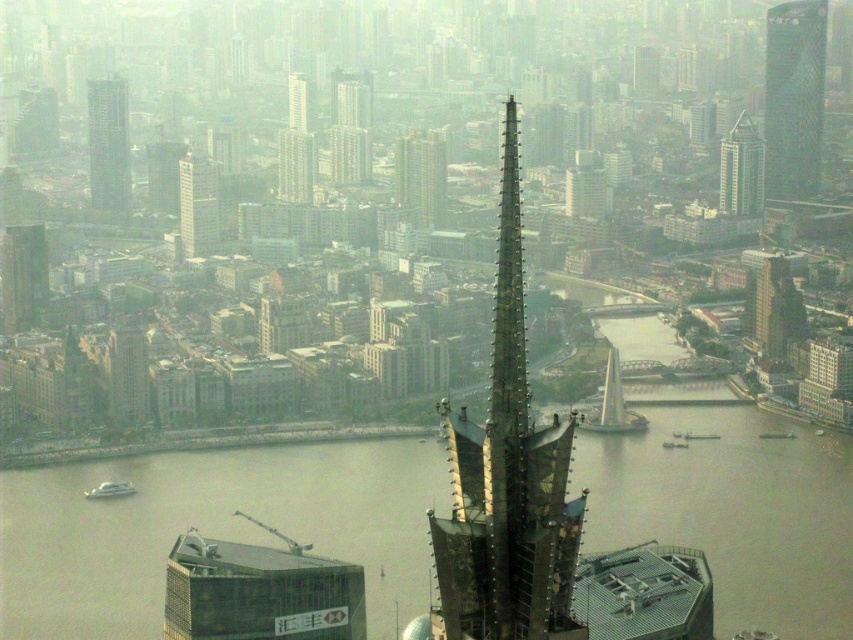
Which is more to the right, brown water at center or matte glass skyscraper at upper left?

Positioned to the right is brown water at center.

Does point (61, 556) lie in front of point (190, 177)?

Yes, point (61, 556) is closer to viewer.

Identify the location of brown water at center. The height and width of the screenshot is (640, 853). (210, 529).

Does green glass building at upper center have a greater width compared to matte gray building at center?

In fact, green glass building at upper center might be narrower than matte gray building at center.

Between point (311, 180) and point (579, 182), which one is positioned behind?

Point (579, 182)

Does point (283, 136) come closer to viewer compared to point (598, 182)?

No, (283, 136) is behind (598, 182).

Where is `green glass building at upper center`? The image size is (853, 640). green glass building at upper center is located at coordinates tap(296, 164).

Who is shorter, green glass building at center or green glass building at upper center?

With less height is green glass building at upper center.

Is point (405, 164) positioned before point (283, 163)?

Yes, it is in front of point (283, 163).

The image size is (853, 640). Identify the location of green glass building at center. (421, 177).

Locate an element on the screen. green glass building at center is located at coordinates (421, 177).